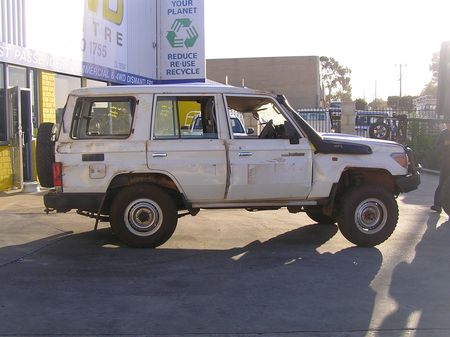
Locate an element on the screen. This screenshot has height=337, width=450. front door is located at coordinates (268, 167).